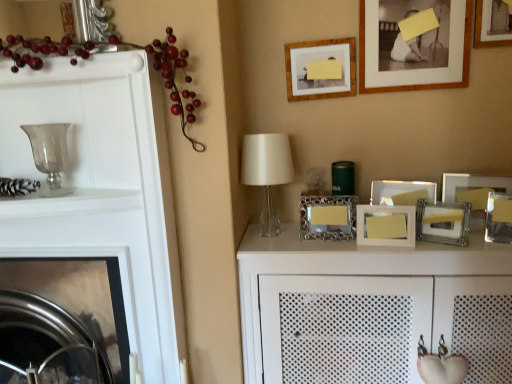
Where is `vacant space in front of metallic silver photo frame at center, which is the seventh picture frame from top to bottom`? This screenshot has width=512, height=384. vacant space in front of metallic silver photo frame at center, which is the seventh picture frame from top to bottom is located at coordinates (337, 241).